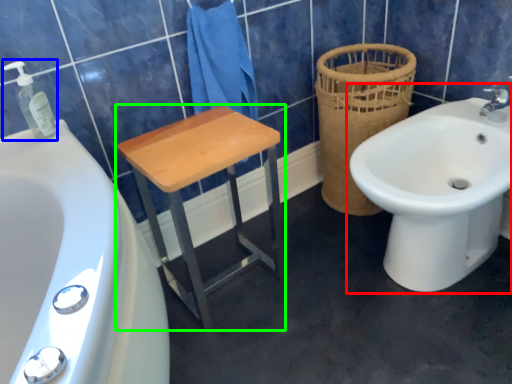
Question: Which object is the closest to the sink (highlighted by a red box)? Choose among these: soap dispenser (highlighted by a blue box) or furniture (highlighted by a green box).

Choices:
 (A) soap dispenser
 (B) furniture

Answer: (B)